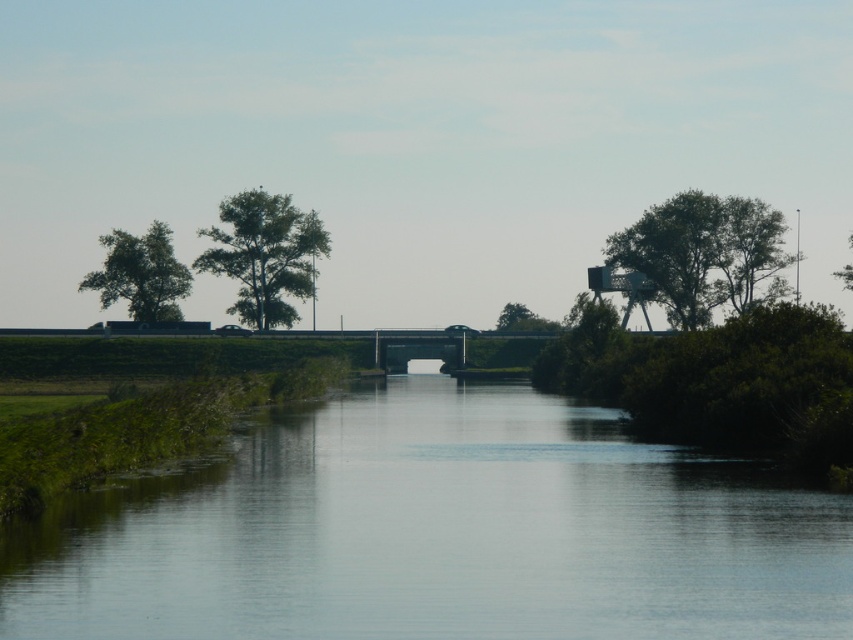
Question: Considering the relative positions of green leafy tree at upper right and green leafy tree at left in the image provided, where is green leafy tree at upper right located with respect to green leafy tree at left?

Choices:
 (A) below
 (B) above

Answer: (B)

Question: Which object is positioned farthest from the green leafy tree at upper center?

Choices:
 (A) clear water at center
 (B) green leafy tree at left
 (C) green leafy tree at center

Answer: (A)

Question: In this image, where is clear water at center located relative to green leafy tree at left?

Choices:
 (A) above
 (B) below

Answer: (B)

Question: Based on their relative distances, which object is nearer to the green leafy tree at left?

Choices:
 (A) green leafy tree at center
 (B) green leafy tree at upper center

Answer: (B)

Question: Which of the following is the farthest from the observer?

Choices:
 (A) (531, 314)
 (B) (704, 323)

Answer: (A)

Question: Can you confirm if green leafy tree at upper right is positioned to the right of green leafy tree at center?

Choices:
 (A) no
 (B) yes

Answer: (B)